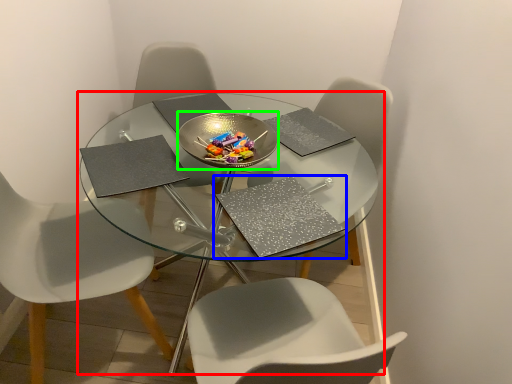
Question: Which object is the farthest from table (highlighted by a red box)? Choose among these: pad (highlighted by a blue box) or glass plate (highlighted by a green box).

Choices:
 (A) pad
 (B) glass plate

Answer: (A)